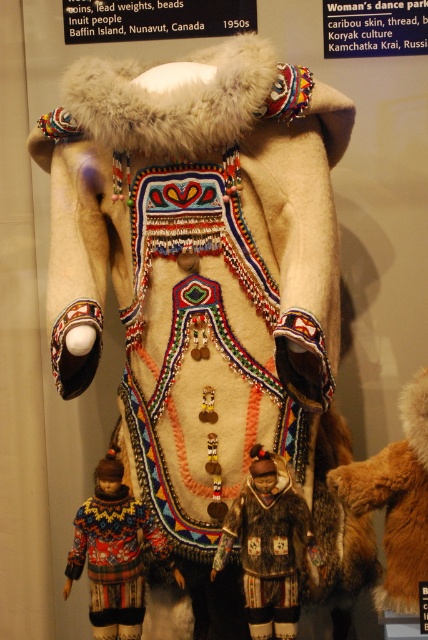
Question: Can you confirm if knitted wool sweater at lower left is positioned to the right of brown fur coat at center?

Choices:
 (A) yes
 (B) no

Answer: (B)

Question: Is knitted wool sweater at lower left bigger than brown fur coat at center?

Choices:
 (A) no
 (B) yes

Answer: (B)

Question: Can you confirm if knitted wool sweater at lower left is wider than brown fur coat at center?

Choices:
 (A) no
 (B) yes

Answer: (A)

Question: Which object appears farthest from the camera in this image?

Choices:
 (A) brown fur coat at center
 (B) knitted wool sweater at lower left

Answer: (B)

Question: Which point is closer to the camera?

Choices:
 (A) brown fur coat at center
 (B) knitted wool sweater at lower left

Answer: (A)